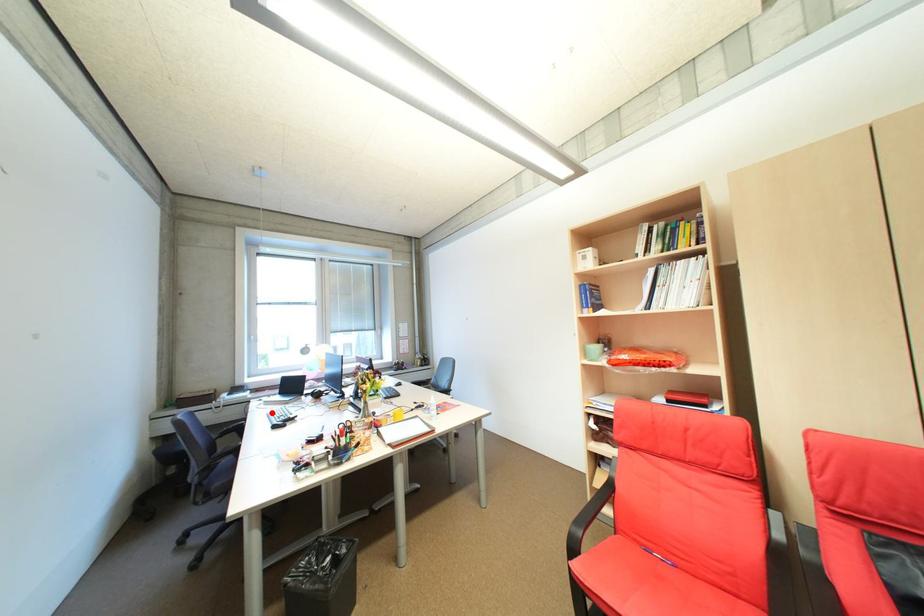
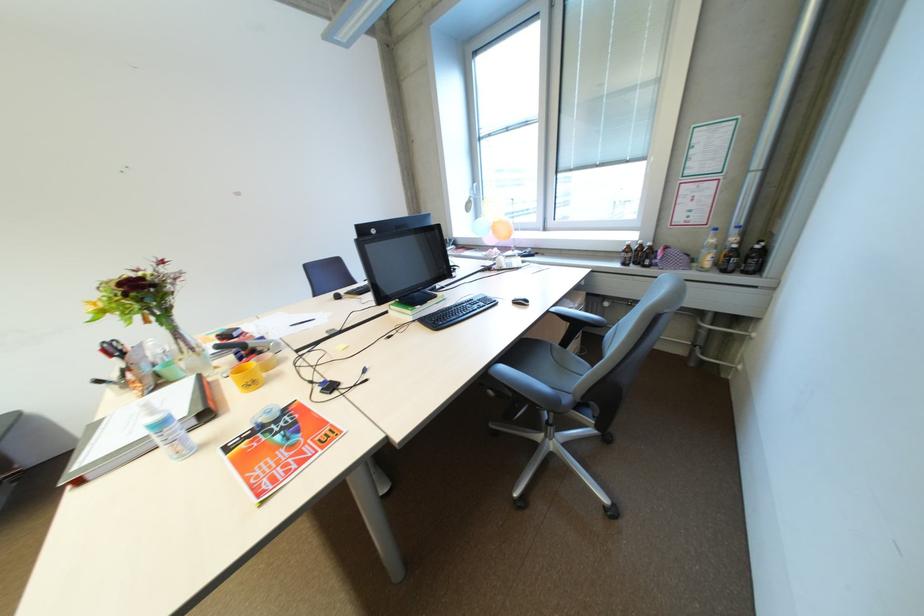
Question: I am providing you with two images of the same scene from different viewpoints. A red point is marked on the first image. Can you still see the location of the red point in image 2?

Choices:
 (A) Yes
 (B) No

Answer: (B)